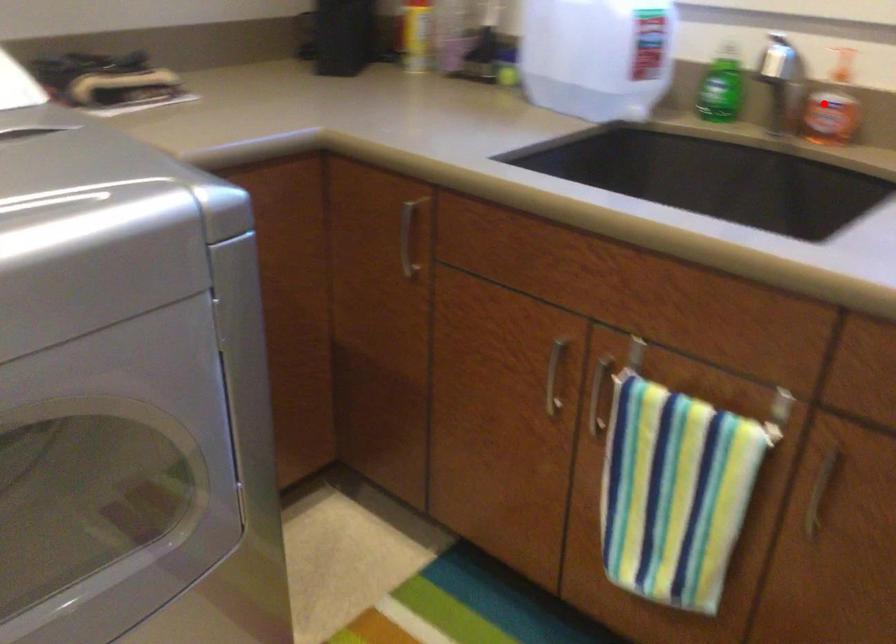
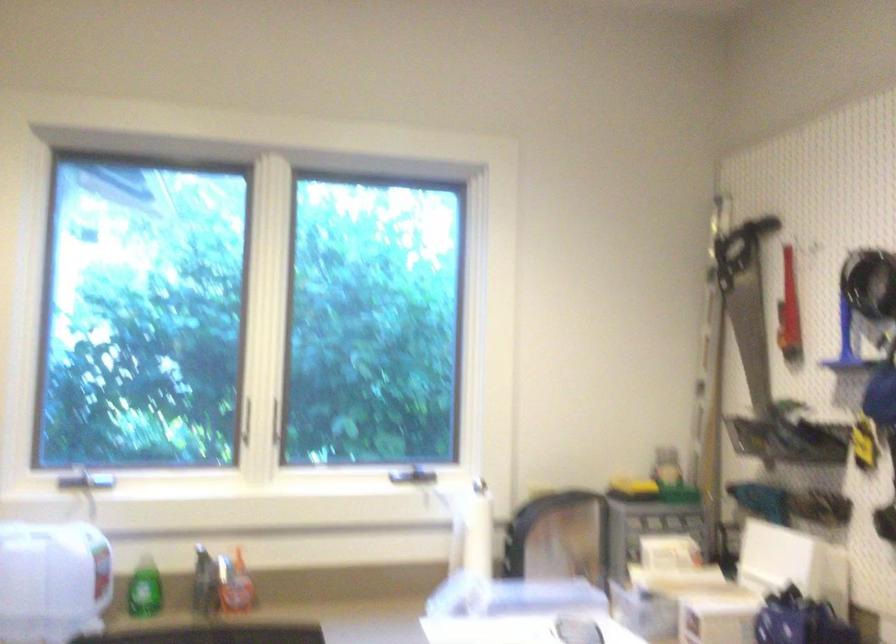
Question: I am providing you with two images of the same scene from different viewpoints. A red point is shown in image1. For the corresponding object point in image2, is it positioned nearer or farther from the camera?

Choices:
 (A) Nearer
 (B) Farther

Answer: (B)